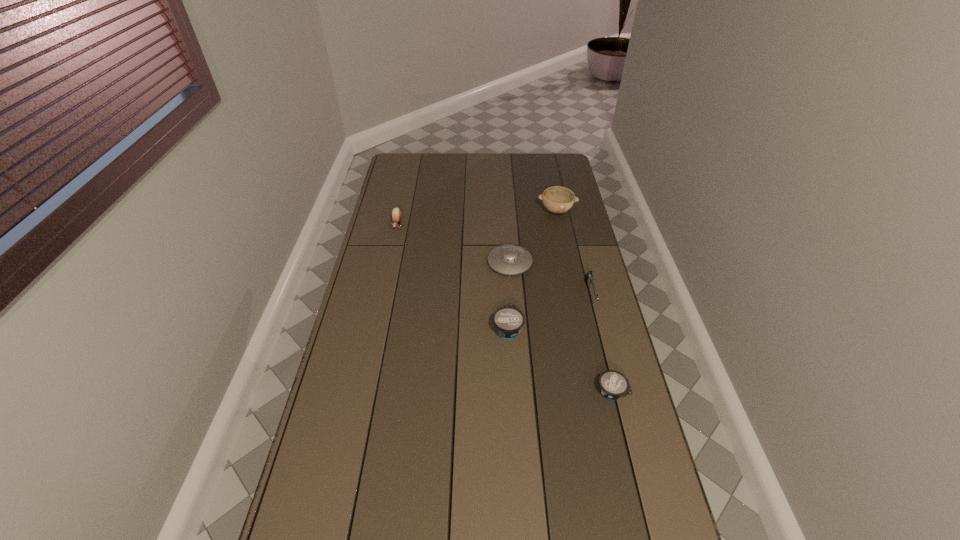
Locate an element on the screen. Image resolution: width=960 pixels, height=540 pixels. vacant area that lies between the saucer and the pistol is located at coordinates (550, 279).

This screenshot has height=540, width=960. I want to click on vacant space that's between the tallest object and the right yogurt, so click(x=584, y=301).

At what (x,y) coordinates should I click in order to perform the action: click on the closest object to the saucer. Please return your answer as a coordinate pair (x, y). The width and height of the screenshot is (960, 540). Looking at the image, I should click on (508, 320).

Where is `object that is the third closest to the pistol`? The height and width of the screenshot is (540, 960). object that is the third closest to the pistol is located at coordinates (613, 385).

Identify the location of blank space that satisfies the following two spatial constraints: 1. on the front side of the farther yogurt; 2. on the right side of the nearer yogurt. The width and height of the screenshot is (960, 540). (511, 392).

Identify the location of blank area in the image that satisfies the following two spatial constraints: 1. on the back side of the tallest object; 2. on the left side of the saucer. (506, 211).